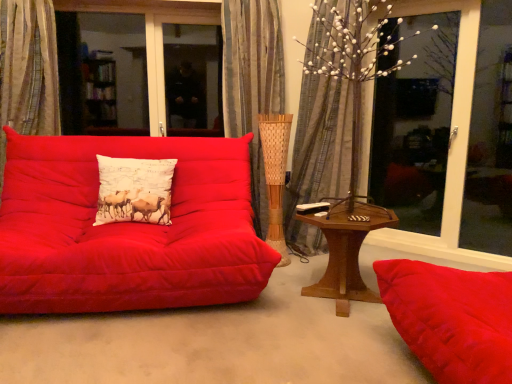
Locate an element on the screen. Image resolution: width=512 pixels, height=384 pixels. empty space that is in between matte red studio couch at left and wooden hexagonal table at center is located at coordinates (292, 283).